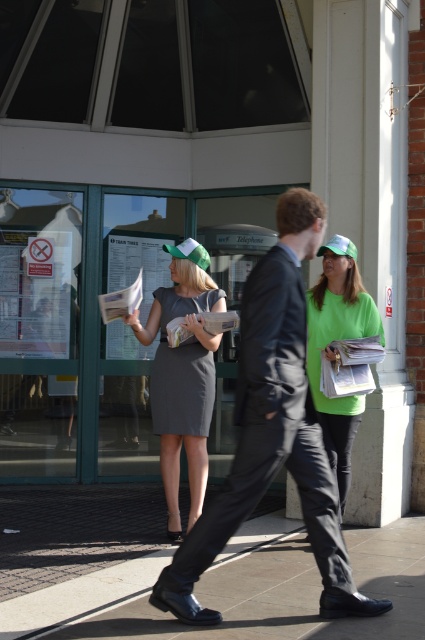
You are standing at the train station and want to walk towards the entrance. There are two points marked on the ground in front of you. The first point is labeled as point (186, 314) and the second is point (351, 257). Which point is closer to the entrance?

Point (351, 257) is closer to the entrance because it is in front of point (186, 314), which is behind it.

You are a photographer standing at the train station. You want to take a photo of the matte gray dress at center and the dark gray matte dress at center. The camera you are using has a minimum focus distance of 8 centimeters. Will both subjects be in focus?

The distance between the matte gray dress at center and dark gray matte dress at center is 8.18 centimeters, which is just over the camera minimum focus distance of 8 centimeters. Therefore, both subjects will be in focus.

What object is located at the coordinate point (183, 376) in the image?

The point (183, 376) corresponds to the matte gray dress at center.